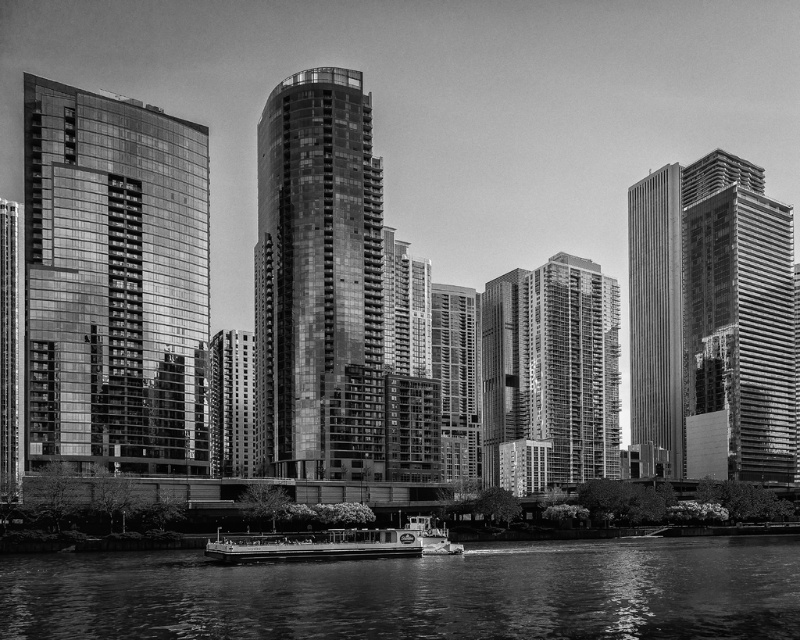
You are a photographer planning to capture the waterfront scene. You want to ensure that the smooth water at lower center and the glossy glass building at center are both visible in your shot. Given their relative sizes, which object should you focus on to frame the shot appropriately?

The smooth water at lower center has a larger width than the glossy glass building at center, so you should focus on framing the shot around the smooth water at lower center to accommodate its wider presence in the scene.

You are a photographer standing at the waterfront. You notice the smooth water at lower center and the glossy glass building at center. Which object appears taller in the photograph?

The glossy glass building at center appears taller than the smooth water at lower center in the photograph.

You are a photographer planning to capture the city skyline from a boat. You notice two reflective structures in your viewfinder, the glassy reflective building at left and the reflective glass skyscraper at right. Based on their reflections, which one appears taller?

The reflective glass skyscraper at right appears taller than the glassy reflective building at left, as it is stated to be taller in the description.